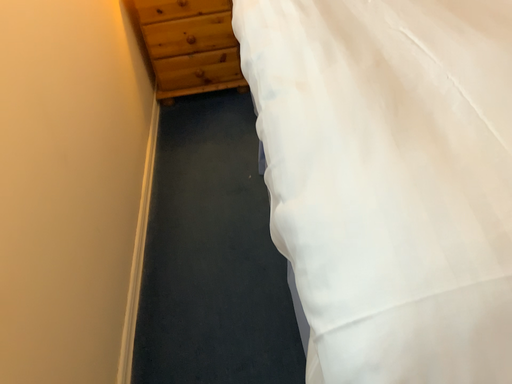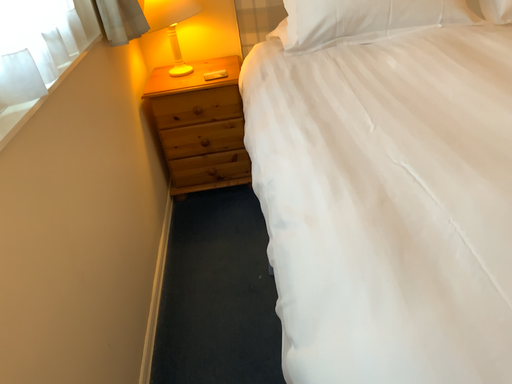
Question: Which way did the camera rotate in the video?

Choices:
 (A) rotated downward
 (B) rotated upward

Answer: (B)